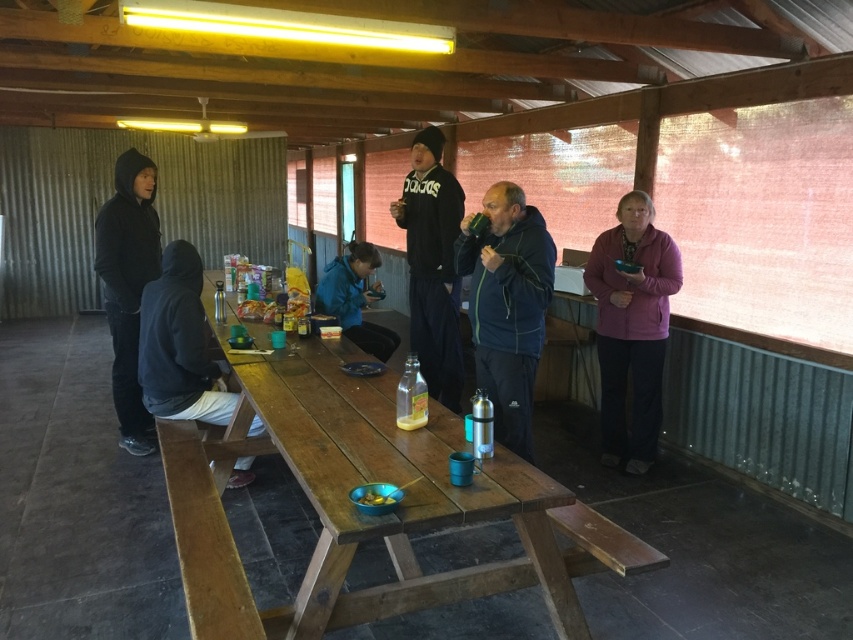
You are organizing a charity event and need to decide which jacket to use for a promotional photo. The black fleece jacket at center and the black fabric jacket at left are available. Based on their sizes, which jacket would be better suited for a child model?

The black fleece jacket at center has a smaller size compared to the black fabric jacket at left, so it would be better suited for a child model.

Looking at this image, you are organizing a small event and need to place a 1.2 meter wide banner between the dark blue jacket at center and the black hoodie at left. Based on their positions, will the banner fit comfortably between them?

The dark blue jacket at center might be wider than the black hoodie at left, so the banner might not fit comfortably between them as the space might be narrower than 1.2 meters.